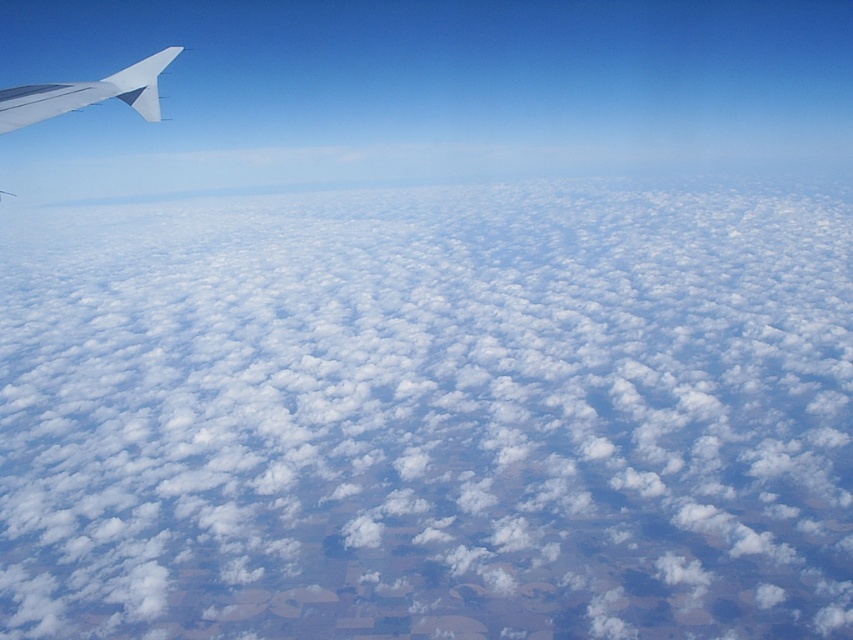
Can you confirm if white fluffy cloud at upper left is positioned to the right of metallic silver wing at upper left?

Incorrect, white fluffy cloud at upper left is not on the right side of metallic silver wing at upper left.

Is white fluffy cloud at upper left to the left of metallic silver wing at upper left from the viewer's perspective?

Yes, white fluffy cloud at upper left is to the left of metallic silver wing at upper left.

Identify the location of white fluffy cloud at upper left. The image size is (853, 640). (430, 413).